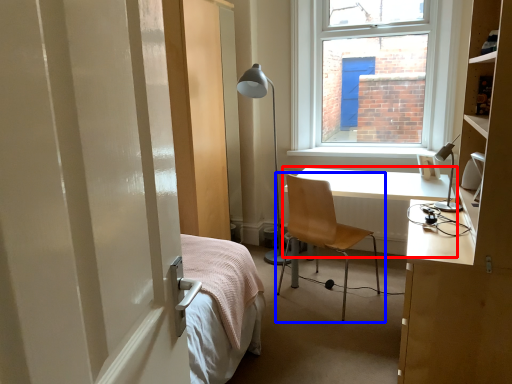
Question: Which object appears closest to the camera in this image, desk (highlighted by a red box) or chair (highlighted by a blue box)?

Choices:
 (A) desk
 (B) chair

Answer: (B)